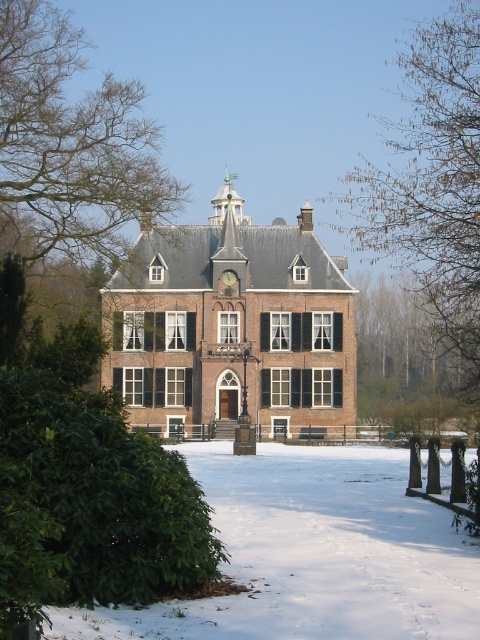
You are standing in front of the Dutch mansion and notice the bare branches at left and the gold metallic clock at center. Which object is nearer to you?

The bare branches at left are closer to the viewer than the gold metallic clock at center.

You are standing in front of the Dutch mansion and see two points marked on the snow. The first point is at coordinate point (x=82, y=448) and the second is at point (x=230, y=285). Which point is closer to you as you face the mansion?

Point (x=82, y=448) is in front of point (x=230, y=285), so it is closer to you as you face the mansion.

You are a gardener planning to place a new decorative item in the garden. You have a gold metallic clock at center and a green leafy bush at lower left. Which object occupies more horizontal space in the scene?

The green leafy bush at lower left occupies more horizontal space than the gold metallic clock at center because its width surpasses the clock.